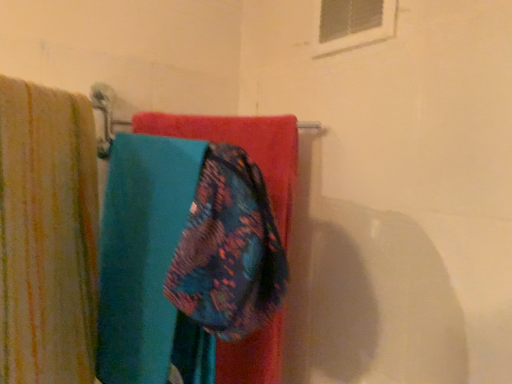
Question: Is white plastic window at upper center with striped cotton towel at left?

Choices:
 (A) yes
 (B) no

Answer: (B)

Question: Does white plastic window at upper center have a lesser width compared to striped cotton towel at left?

Choices:
 (A) no
 (B) yes

Answer: (B)

Question: From a real-world perspective, is white plastic window at upper center beneath striped cotton towel at left?

Choices:
 (A) no
 (B) yes

Answer: (A)

Question: Is white plastic window at upper center positioned beyond the bounds of striped cotton towel at left?

Choices:
 (A) yes
 (B) no

Answer: (A)

Question: From a real-world perspective, is white plastic window at upper center on striped cotton towel at left?

Choices:
 (A) yes
 (B) no

Answer: (A)

Question: Is point (263, 344) closer or farther from the camera than point (30, 342)?

Choices:
 (A) closer
 (B) farther

Answer: (B)

Question: In the image, is floral fabric towel at center positioned in front of or behind teal fabric towel at center?

Choices:
 (A) behind
 (B) front

Answer: (B)

Question: Is floral fabric towel at center inside or outside of teal fabric towel at center?

Choices:
 (A) inside
 (B) outside

Answer: (A)

Question: From the image's perspective, is floral fabric towel at center located above or below teal fabric towel at center?

Choices:
 (A) below
 (B) above

Answer: (B)

Question: From the image's perspective, relative to teal fabric towel at center, is striped cotton towel at left above or below?

Choices:
 (A) above
 (B) below

Answer: (A)

Question: Considering the relative positions of striped cotton towel at left and teal fabric towel at center in the image provided, is striped cotton towel at left to the left or to the right of teal fabric towel at center?

Choices:
 (A) right
 (B) left

Answer: (B)

Question: Is point (82, 367) positioned closer to the camera than point (39, 97)?

Choices:
 (A) closer
 (B) farther

Answer: (B)

Question: In terms of height, does striped cotton towel at left look taller or shorter compared to teal fabric towel at center?

Choices:
 (A) short
 (B) tall

Answer: (B)

Question: Choose the correct answer: Is striped cotton towel at left inside floral fabric towel at center or outside it?

Choices:
 (A) outside
 (B) inside

Answer: (A)

Question: In terms of size, does striped cotton towel at left appear bigger or smaller than floral fabric towel at center?

Choices:
 (A) big
 (B) small

Answer: (A)